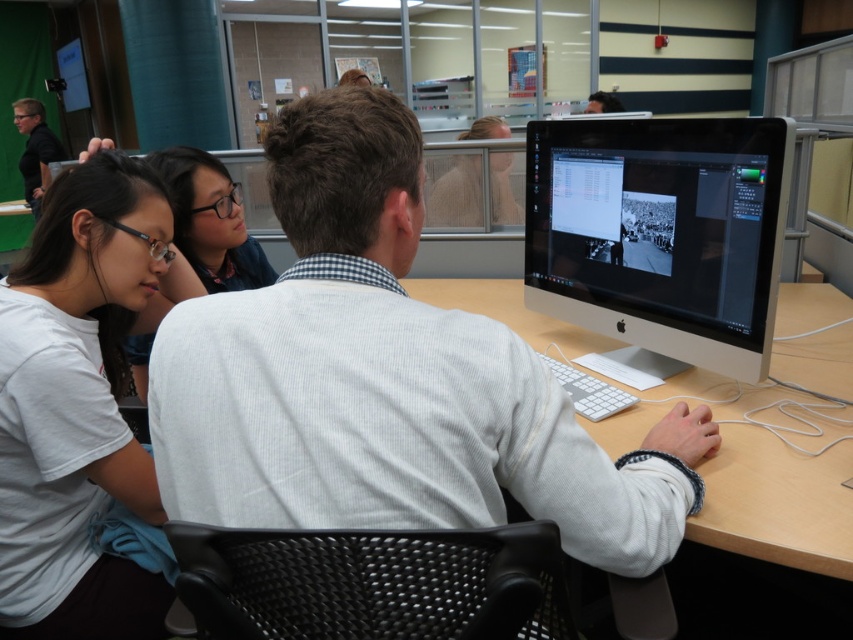
You are a person standing behind the group at the back of the room. You need to see both the sleek silver monitor at center and the matte black shirt at left. Which object will appear smaller to you?

The sleek silver monitor at center will appear smaller because it is physically smaller in size compared to the matte black shirt at left.

What object is located at the coordinates point (660, 236) in the image?

The point (660, 236) corresponds to the sleek silver monitor at center.

Consider the image. You are a delivery person who just arrived at the office. You need to place a new monitor that is the same size as the sleek silver monitor at center on top of the white ribbed sweater at center. Will the new monitor fit on the sweater?

The white ribbed sweater at center has a larger size compared to sleek silver monitor at center. Therefore, the new monitor will fit on the white ribbed sweater at center since the sweater is bigger.